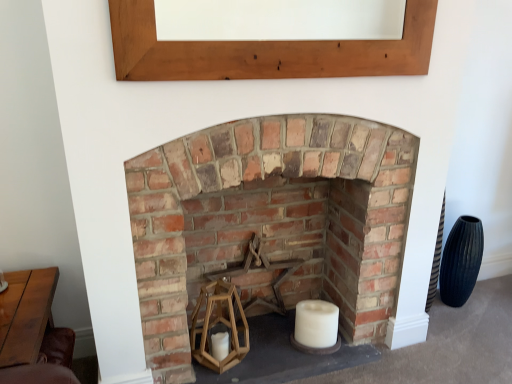
Question: Can you see wooden at center touching white matte candle at center?

Choices:
 (A) yes
 (B) no

Answer: (B)

Question: Considering the relative sizes of wooden at center and white matte candle at center in the image provided, is wooden at center shorter than white matte candle at center?

Choices:
 (A) yes
 (B) no

Answer: (B)

Question: From a real-world perspective, is wooden at center beneath white matte candle at center?

Choices:
 (A) no
 (B) yes

Answer: (A)

Question: Considering the relative sizes of wooden at center and white matte candle at center in the image provided, is wooden at center thinner than white matte candle at center?

Choices:
 (A) yes
 (B) no

Answer: (A)

Question: Considering the relative positions of wooden at center and white matte candle at center in the image provided, is wooden at center to the right of white matte candle at center from the viewer's perspective?

Choices:
 (A) no
 (B) yes

Answer: (A)

Question: From a real-world perspective, relative to rustic brick fireplace at center, is light brown wood at upper center vertically above or below?

Choices:
 (A) above
 (B) below

Answer: (A)

Question: Is light brown wood at upper center in front of or behind rustic brick fireplace at center in the image?

Choices:
 (A) front
 (B) behind

Answer: (A)

Question: Is point (121, 44) positioned closer to the camera than point (159, 286)?

Choices:
 (A) farther
 (B) closer

Answer: (B)

Question: Is light brown wood at upper center wider or thinner than rustic brick fireplace at center?

Choices:
 (A) wide
 (B) thin

Answer: (B)

Question: From a real-world perspective, is wooden table at lower left physically located above or below light brown wood at upper center?

Choices:
 (A) above
 (B) below

Answer: (B)

Question: From the image's perspective, is wooden table at lower left above or below light brown wood at upper center?

Choices:
 (A) below
 (B) above

Answer: (A)

Question: Is wooden table at lower left in front of or behind light brown wood at upper center in the image?

Choices:
 (A) front
 (B) behind

Answer: (A)

Question: In terms of width, does wooden table at lower left look wider or thinner when compared to light brown wood at upper center?

Choices:
 (A) wide
 (B) thin

Answer: (A)

Question: Is wooden at center bigger or smaller than rustic brick fireplace at center?

Choices:
 (A) small
 (B) big

Answer: (A)

Question: Would you say wooden at center is to the left or to the right of rustic brick fireplace at center in the picture?

Choices:
 (A) left
 (B) right

Answer: (A)